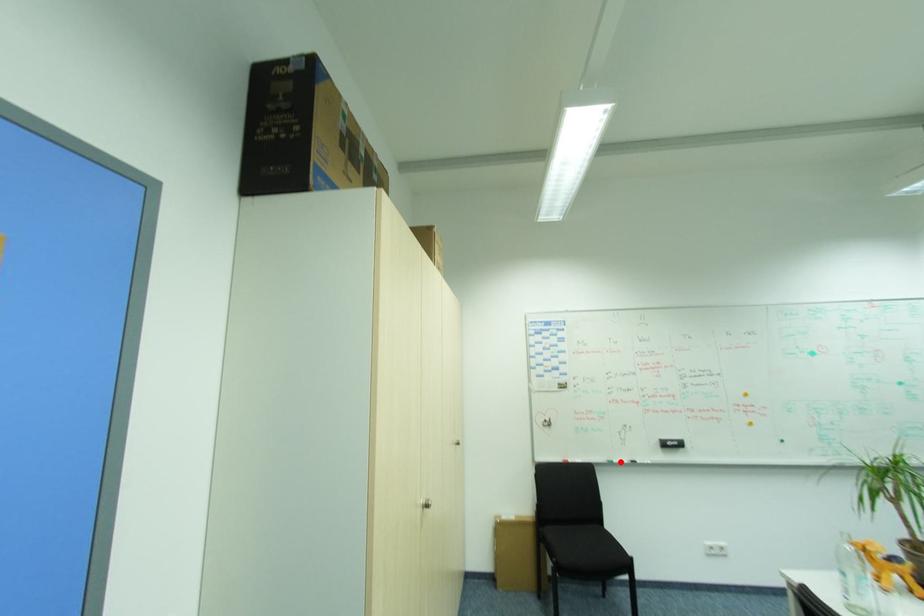
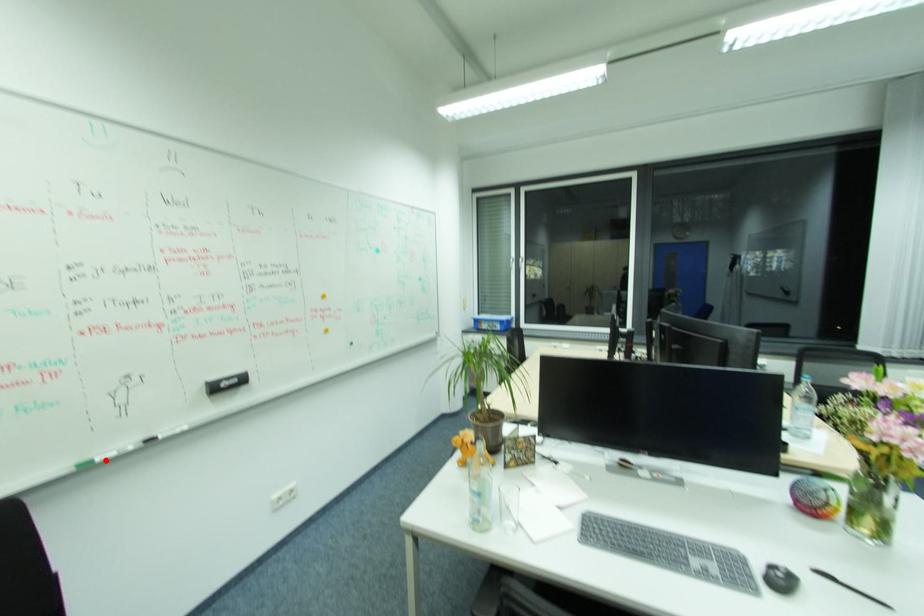
I am providing you with two images of the same scene from different viewpoints. A red point is marked on the first image and another point is marked on the second image. Does the point marked in image1 correspond to the same location as the one in image2?

Yes